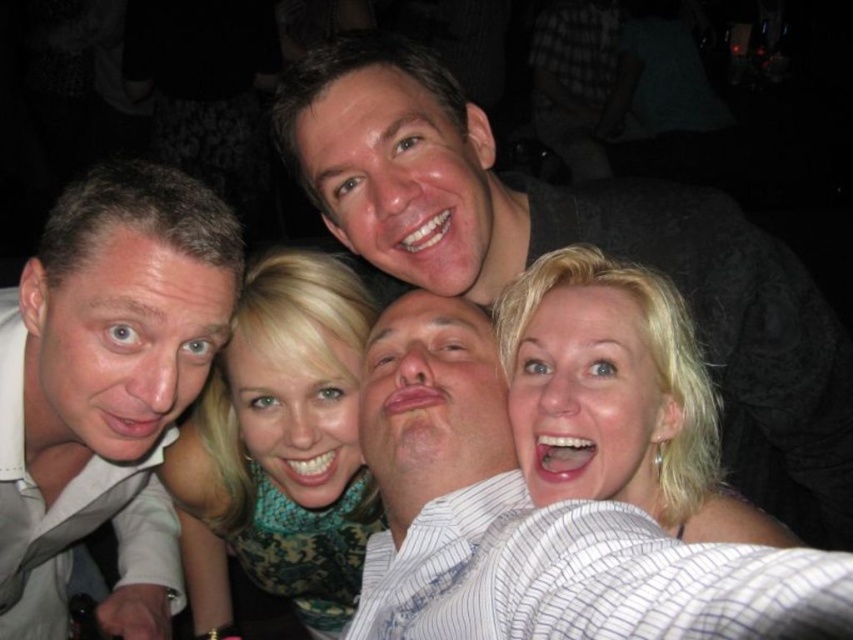
You are trying to identify the person in the center of the image. There are two notable features here, the matte gray shirt at upper center and the blonde hair at center. Which of these two features has a greater width?

The matte gray shirt at upper center has a greater width than the blonde hair at center.

You are standing in the center of the room and want to hand a gift to the person wearing the matte gray shirt at upper center. Based on their position coordinates, in which direction should you move to reach them?

The matte gray shirt at upper center is located at coordinates point 0.378 on the x axis and 0.678 on the y axis. Since you are at the center, you should move to the left and forward to reach them.